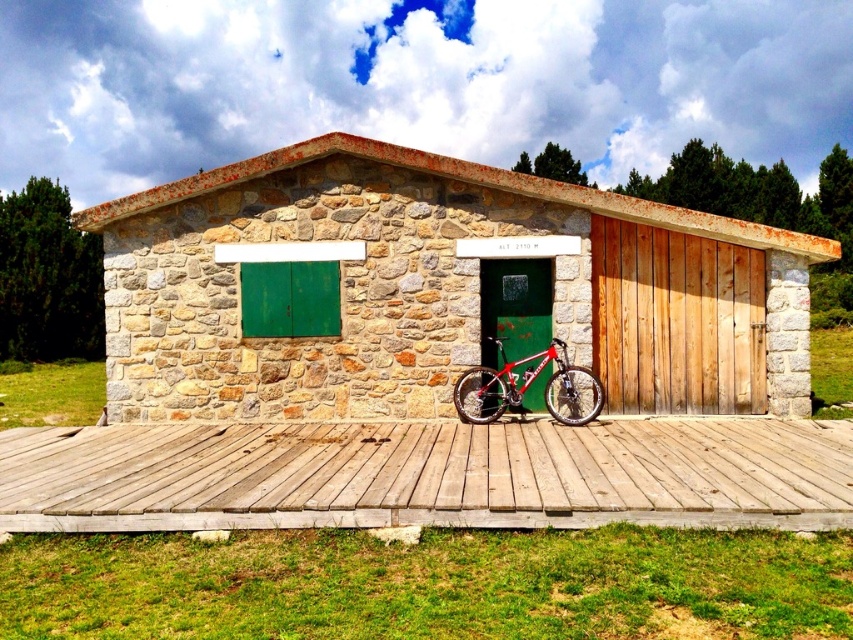
Question: Which of the following is the farthest from the observer?

Choices:
 (A) (584, 388)
 (B) (401, 394)

Answer: (B)

Question: Is stone textured hut at center positioned in front of shiny metallic bicycle at center?

Choices:
 (A) yes
 (B) no

Answer: (B)

Question: Does stone textured hut at center have a greater width compared to shiny metallic bicycle at center?

Choices:
 (A) no
 (B) yes

Answer: (B)

Question: Is stone textured hut at center in front of shiny metallic bicycle at center?

Choices:
 (A) yes
 (B) no

Answer: (B)